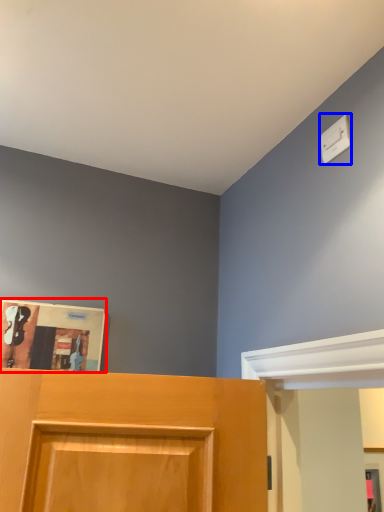
Question: Which object is closer to the camera taking this photo, magazine (highlighted by a red box) or light switch (highlighted by a blue box)?

Choices:
 (A) magazine
 (B) light switch

Answer: (B)